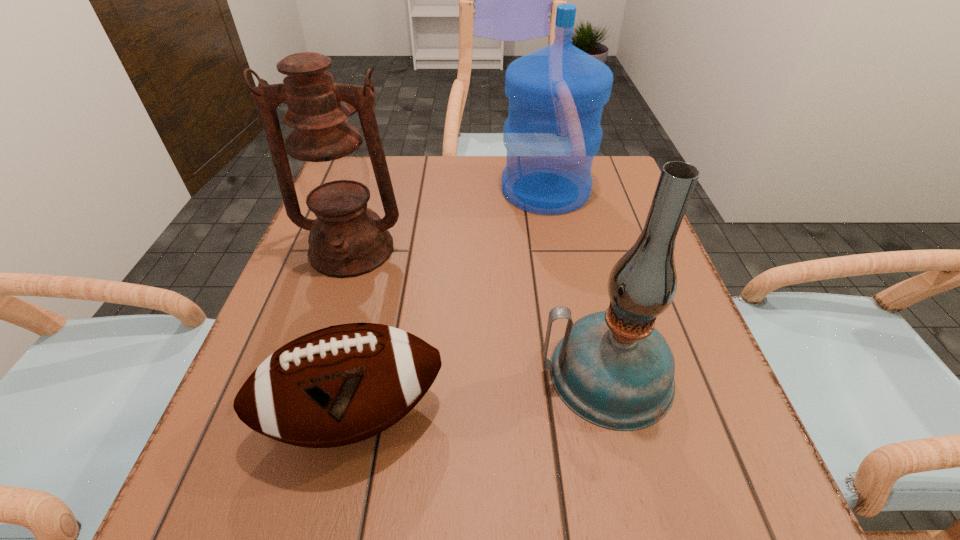
The height and width of the screenshot is (540, 960). I want to click on free space at the far right corner of the desktop, so click(x=639, y=204).

What are the coordinates of `vacant space at the near right corner` in the screenshot? It's located at (689, 480).

Where is `vacant space that's between the third nearest object and the water jug`? The image size is (960, 540). vacant space that's between the third nearest object and the water jug is located at coordinates (448, 220).

Where is `free area in between the shortest object and the nearer oil lamp`? The width and height of the screenshot is (960, 540). free area in between the shortest object and the nearer oil lamp is located at coordinates (481, 394).

This screenshot has height=540, width=960. I want to click on vacant area between the shortest object and the water jug, so click(x=450, y=302).

You are a GUI agent. You are given a task and a screenshot of the screen. Output one action in this format:
    pyautogui.click(x=<x>, y=<y>)
    Task: Click on the free spot between the left oil lamp and the water jug
    The width and height of the screenshot is (960, 540).
    Given the screenshot: What is the action you would take?
    pyautogui.click(x=448, y=220)

Locate an element on the screen. The height and width of the screenshot is (540, 960). vacant area that lies between the farther oil lamp and the water jug is located at coordinates (448, 220).

At what (x,y) coordinates should I click in order to perform the action: click on vacant space in between the water jug and the shortest object. Please return your answer as a coordinate pair (x, y). Looking at the image, I should click on (450, 302).

You are a GUI agent. You are given a task and a screenshot of the screen. Output one action in this format:
    pyautogui.click(x=<x>, y=<y>)
    Task: Click on the vacant space that's between the water jug and the third nearest object
    The height and width of the screenshot is (540, 960).
    Given the screenshot: What is the action you would take?
    pyautogui.click(x=448, y=220)

Where is `free space that is in between the shortest object and the nearer oil lamp`? This screenshot has width=960, height=540. free space that is in between the shortest object and the nearer oil lamp is located at coordinates (481, 394).